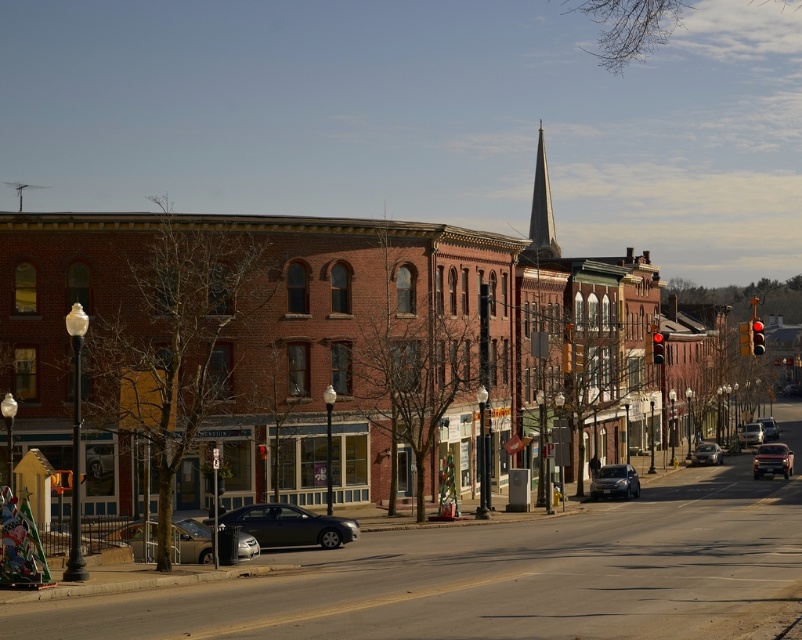
Does point (626, 483) come farther from viewer compared to point (740, 435)?

That is False.

From the picture: Is shiny silver sedan at center below metallic silver sedan at center-right?

Actually, shiny silver sedan at center is above metallic silver sedan at center-right.

Is point (597, 484) positioned behind point (756, 435)?

No, (597, 484) is closer to viewer.

I want to click on shiny silver sedan at center, so click(614, 483).

Does point (294, 515) come in front of point (529, 256)?

Yes, point (294, 515) is in front of point (529, 256).

Measure the distance between point (272, 502) and camera.

Point (272, 502) and camera are 42.44 meters apart.

This screenshot has height=640, width=802. I want to click on satin black sedan at center, so click(290, 525).

Between brick building at center and silver metallic sedan at center, which one appears on the left side from the viewer's perspective?

brick building at center is more to the left.

Is brick building at center positioned before silver metallic sedan at center?

Yes, it is in front of silver metallic sedan at center.

In order to click on brick building at center in this screenshot , I will do `click(435, 358)`.